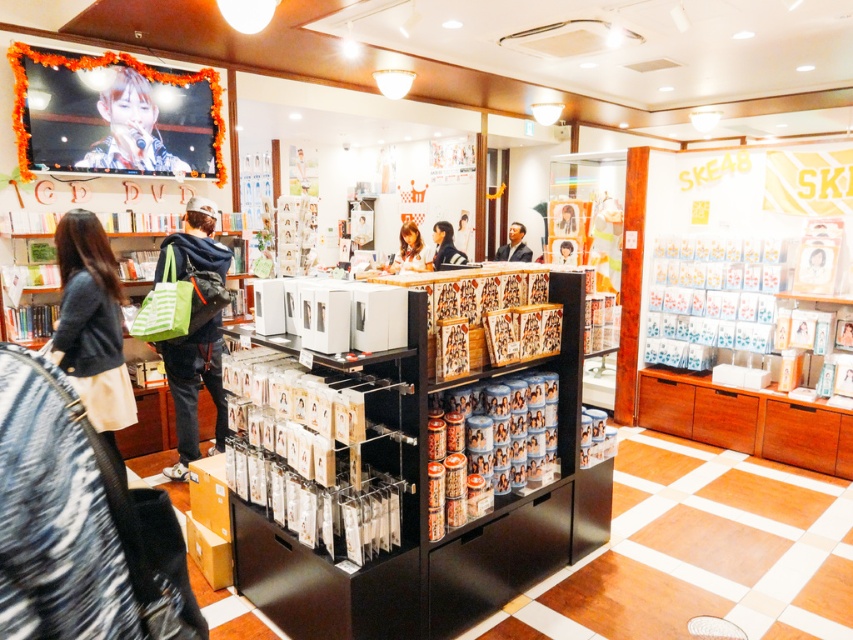
Can you confirm if dark gray sweater at lower left is positioned to the left of matte black jacket at center?

Indeed, dark gray sweater at lower left is positioned on the left side of matte black jacket at center.

Is dark gray sweater at lower left to the right of matte black jacket at center from the viewer's perspective?

In fact, dark gray sweater at lower left is to the left of matte black jacket at center.

The width and height of the screenshot is (853, 640). I want to click on dark gray sweater at lower left, so click(x=91, y=326).

Can you confirm if green striped tote bag at center is positioned below matte black jacket at center?

Yes, green striped tote bag at center is below matte black jacket at center.

Between green striped tote bag at center and matte black jacket at center, which one appears on the left side from the viewer's perspective?

From the viewer's perspective, green striped tote bag at center appears more on the left side.

The width and height of the screenshot is (853, 640). Describe the element at coordinates (194, 388) in the screenshot. I see `green striped tote bag at center` at that location.

This screenshot has height=640, width=853. I want to click on green striped tote bag at center, so click(x=194, y=388).

Does green striped tote bag at center appear over smooth brown hair at center?

Actually, green striped tote bag at center is below smooth brown hair at center.

Does point (212, 257) lie behind point (401, 228)?

No, (212, 257) is closer to viewer.

This screenshot has height=640, width=853. Identify the location of green striped tote bag at center. (194, 388).